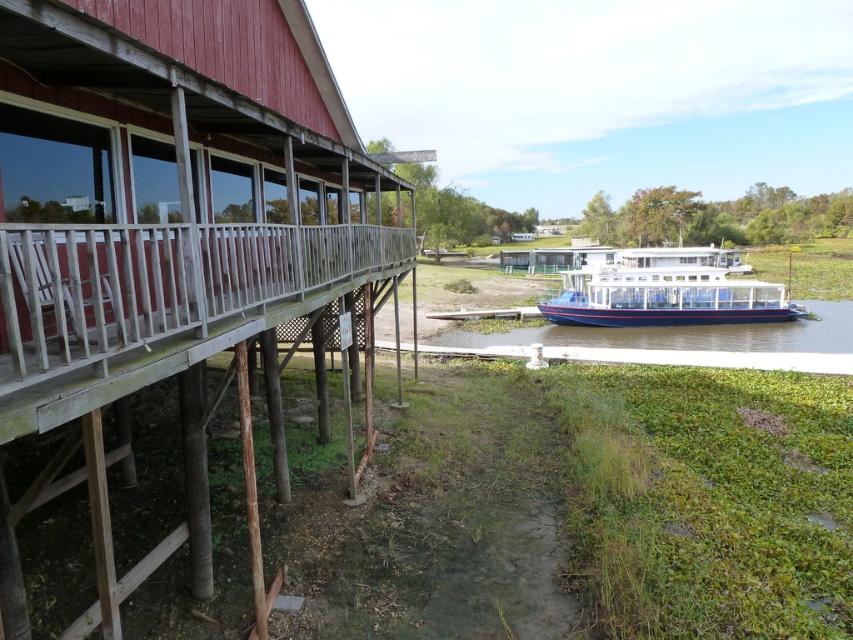
Does point (91, 20) come behind point (614, 310)?

No, (91, 20) is in front of (614, 310).

Between point (103, 630) and point (635, 269), which one is positioned in front?

Point (103, 630) is more forward.

Find the location of a particular element. wooden dock at left is located at coordinates (163, 225).